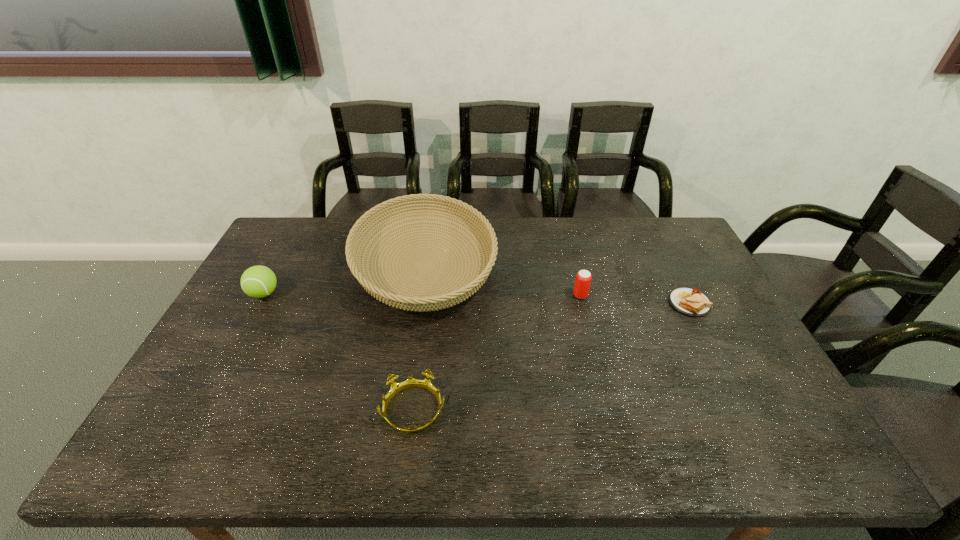
Where is `blank space at the far left corner`? blank space at the far left corner is located at coordinates (292, 252).

The width and height of the screenshot is (960, 540). I want to click on vacant space at the far right corner, so click(637, 226).

Locate an element on the screen. Image resolution: width=960 pixels, height=540 pixels. free region at the near right corner is located at coordinates (787, 429).

Image resolution: width=960 pixels, height=540 pixels. In order to click on empty location between the crown and the beer can in this screenshot , I will do point(497,353).

Identify the location of vacant point located between the nearest object and the basket. (420, 338).

This screenshot has width=960, height=540. In order to click on vacant space that is in between the leftmost object and the rightmost object in this screenshot , I will do `click(476, 299)`.

This screenshot has width=960, height=540. In order to click on free space between the basket and the second shortest object in this screenshot , I will do `click(420, 338)`.

Locate an element on the screen. vacant point located between the nearest object and the second object from right to left is located at coordinates (497, 353).

This screenshot has width=960, height=540. In order to click on free space between the crown and the basket in this screenshot , I will do `click(420, 338)`.

I want to click on vacant point located between the basket and the tennis ball, so click(x=345, y=280).